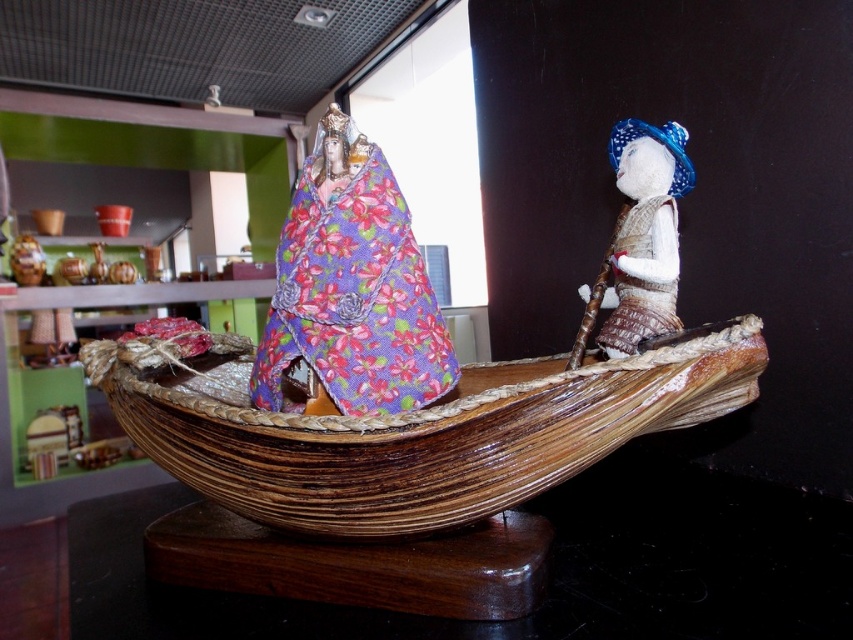
Question: Can you confirm if wooden boat at center is bigger than textured beige doll at right?

Choices:
 (A) no
 (B) yes

Answer: (B)

Question: From the image, what is the correct spatial relationship of wooden boat at center in relation to textured beige doll at right?

Choices:
 (A) right
 (B) left

Answer: (B)

Question: Which point appears closest to the camera in this image?

Choices:
 (A) (363, 273)
 (B) (670, 202)

Answer: (A)

Question: Can you confirm if wooden boat at center is wider than textured beige doll at right?

Choices:
 (A) yes
 (B) no

Answer: (A)